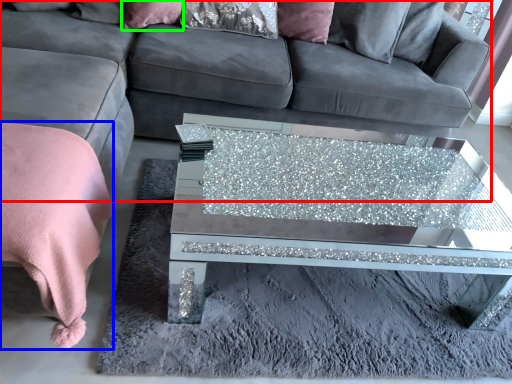
Question: Estimate the real-world distances between objects in this image. Which object is closer to studio couch (highlighted by a red box), blanket (highlighted by a blue box) or pillow (highlighted by a green box)?

Choices:
 (A) blanket
 (B) pillow

Answer: (B)